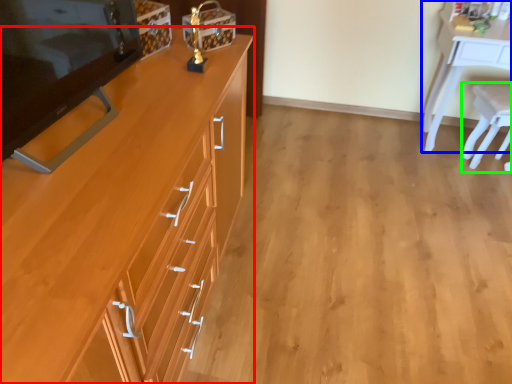
Question: Which is nearer to the cabinetry (highlighted by a red box)? desk (highlighted by a blue box) or chair (highlighted by a green box).

Choices:
 (A) desk
 (B) chair

Answer: (A)